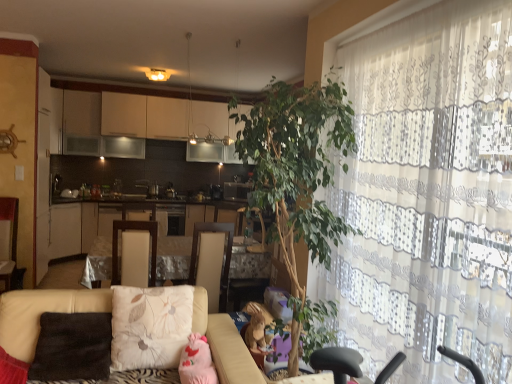
Question: Considering the relative sizes of satin silver microwave at center and fluffy beige pillow at center, positioned as the second pillow in left-to-right order, in the image provided, is satin silver microwave at center thinner than fluffy beige pillow at center, positioned as the second pillow in left-to-right order,?

Choices:
 (A) no
 (B) yes

Answer: (A)

Question: Does satin silver microwave at center come in front of fluffy beige pillow at center, which is counted as the first pillow, starting from the right?

Choices:
 (A) yes
 (B) no

Answer: (B)

Question: Can you confirm if satin silver microwave at center is positioned to the right of fluffy beige pillow at center, which is counted as the first pillow, starting from the right?

Choices:
 (A) no
 (B) yes

Answer: (B)

Question: Is satin silver microwave at center turned away from fluffy beige pillow at center, which is counted as the first pillow, starting from the right?

Choices:
 (A) yes
 (B) no

Answer: (B)

Question: Considering the relative sizes of satin silver microwave at center and fluffy beige pillow at center, which is counted as the first pillow, starting from the right, in the image provided, is satin silver microwave at center wider than fluffy beige pillow at center, which is counted as the first pillow, starting from the right,?

Choices:
 (A) no
 (B) yes

Answer: (B)

Question: Considering the positions of white glossy cabinets at center and green leafy plant at center in the image, is white glossy cabinets at center wider or thinner than green leafy plant at center?

Choices:
 (A) wide
 (B) thin

Answer: (B)

Question: From a real-world perspective, is white glossy cabinets at center physically located above or below green leafy plant at center?

Choices:
 (A) above
 (B) below

Answer: (B)

Question: Is white glossy cabinets at center situated inside green leafy plant at center or outside?

Choices:
 (A) inside
 (B) outside

Answer: (B)

Question: From the image's perspective, is white glossy cabinets at center above or below green leafy plant at center?

Choices:
 (A) below
 (B) above

Answer: (A)

Question: Is brown plush toy at lower center, the first toy positioned from the back, spatially inside beige fabric swivel chair at center, marked as the 2th swivel chair in a left-to-right arrangement, or outside of it?

Choices:
 (A) inside
 (B) outside

Answer: (B)

Question: From the image's perspective, is brown plush toy at lower center, marked as the second toy in a front-to-back arrangement, above or below beige fabric swivel chair at center, marked as the 2th swivel chair in a left-to-right arrangement?

Choices:
 (A) above
 (B) below

Answer: (B)

Question: Based on their positions, is brown plush toy at lower center, which appears as the 1th toy when viewed from the right, located to the left or right of beige fabric swivel chair at center, the first swivel chair positioned from the right?

Choices:
 (A) left
 (B) right

Answer: (B)

Question: Is point (262, 347) closer or farther from the camera than point (219, 292)?

Choices:
 (A) closer
 (B) farther

Answer: (A)

Question: Is green leafy plant at center in front of or behind satin silver microwave at center in the image?

Choices:
 (A) behind
 (B) front

Answer: (B)

Question: Is point pos(328,168) closer or farther from the camera than point pos(239,196)?

Choices:
 (A) farther
 (B) closer

Answer: (B)